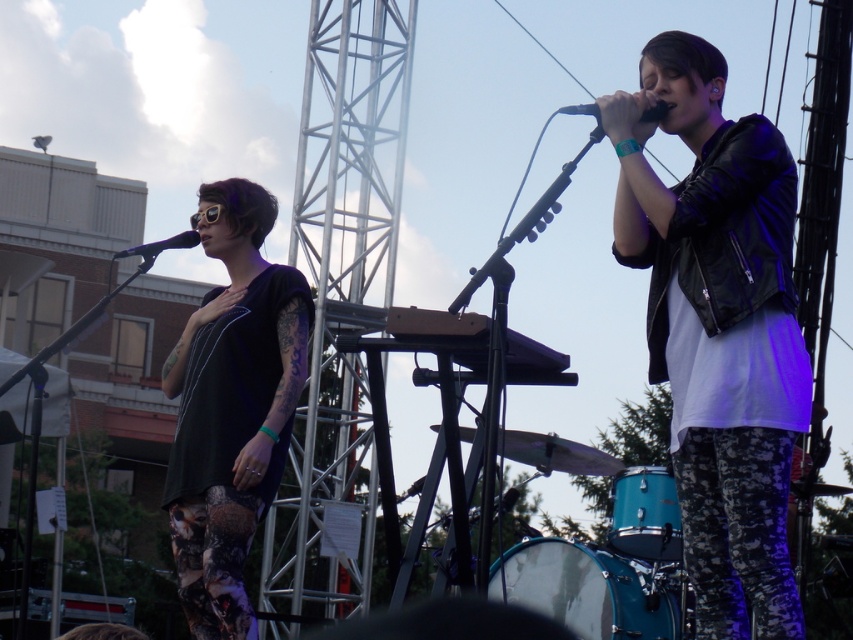
Is leather jacket at upper right to the left of black matte shirt at left from the viewer's perspective?

In fact, leather jacket at upper right is to the right of black matte shirt at left.

Who is positioned more to the right, leather jacket at upper right or black matte shirt at left?

From the viewer's perspective, leather jacket at upper right appears more on the right side.

Is point (746, 397) behind point (181, 346)?

No, it is in front of (181, 346).

Find the location of a particular element. The height and width of the screenshot is (640, 853). leather jacket at upper right is located at coordinates (718, 328).

Does black matte shirt at left appear under black matte microphone at left?

Indeed, black matte shirt at left is positioned under black matte microphone at left.

Is black matte shirt at left further to camera compared to black matte microphone at left?

Yes.

Which is behind, point (260, 497) or point (142, 248)?

Positioned behind is point (260, 497).

Identify the location of black matte shirt at left. This screenshot has width=853, height=640. (231, 406).

Who is shorter, leather jacket at upper right or black matte microphone at left?

With less height is black matte microphone at left.

Is leather jacket at upper right bigger than black matte microphone at left?

Incorrect, leather jacket at upper right is not larger than black matte microphone at left.

Does point (635, 243) lie in front of point (199, 241)?

That is True.

The image size is (853, 640). In order to click on leather jacket at upper right in this screenshot , I will do `click(718, 328)`.